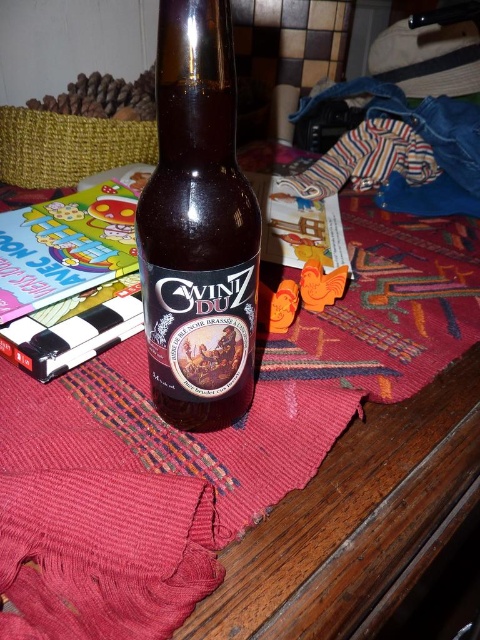
Question: In this image, where is brown glass bottle at center located relative to hardcover book at center-left?

Choices:
 (A) below
 (B) above

Answer: (A)

Question: From the image, what is the correct spatial relationship of brown glass bottle at center in relation to hardcover book at center-left?

Choices:
 (A) above
 (B) below

Answer: (B)

Question: Is brown glass bottle at center to the right of hardcover book at center-left from the viewer's perspective?

Choices:
 (A) no
 (B) yes

Answer: (B)